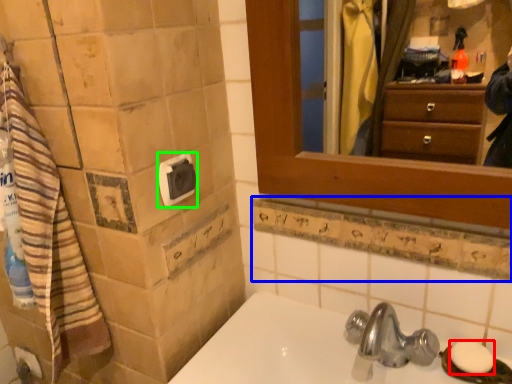
Question: Which object is the closest to the soap (highlighted by a red box)? Choose among these: ledge (highlighted by a blue box) or towel bar (highlighted by a green box).

Choices:
 (A) ledge
 (B) towel bar

Answer: (A)